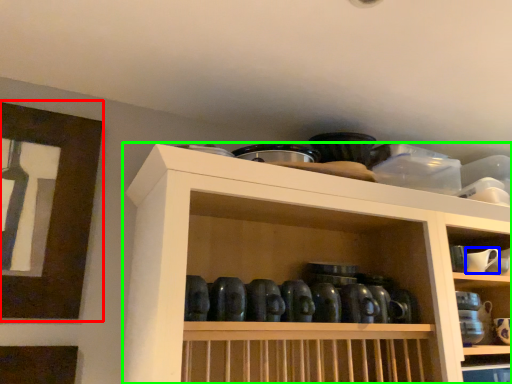
Question: Which object is the closest to the picture frame (highlighted by a red box)? Choose among these: tableware (highlighted by a blue box) or shelf (highlighted by a green box).

Choices:
 (A) tableware
 (B) shelf

Answer: (B)